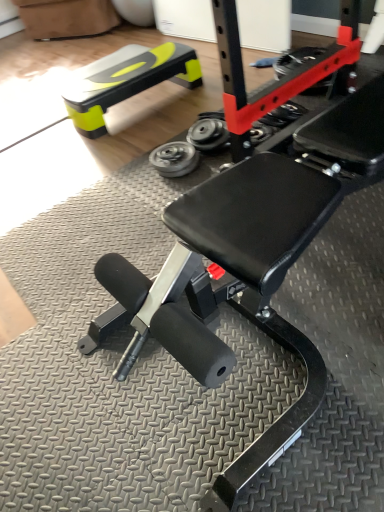
Identify the location of blank space situated above metallic silver wheel at center, placed as the first wheel when sorted from left to right (from a real-world perspective). (174, 150).